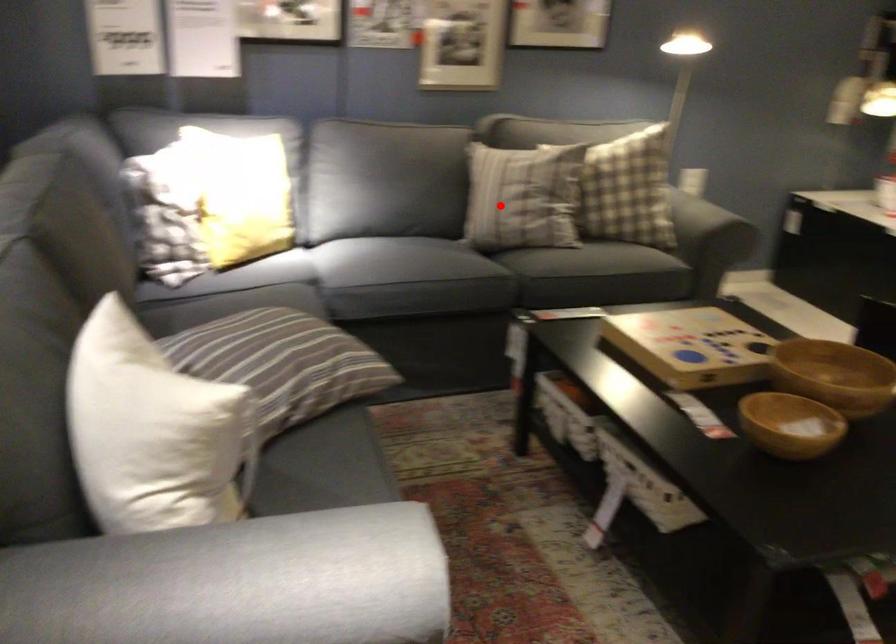
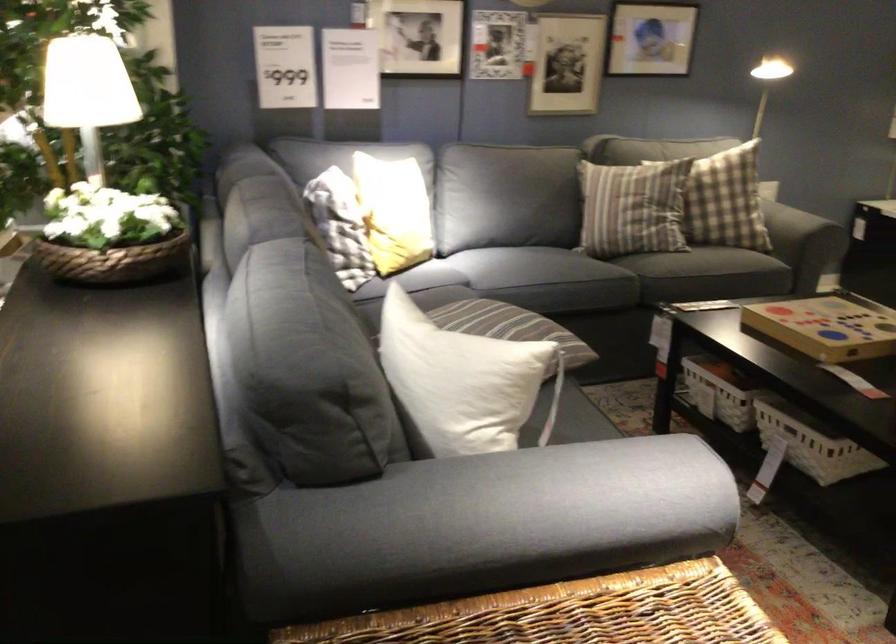
The point at the highlighted location is marked in the first image. Where is the corresponding point in the second image?

(633, 207)